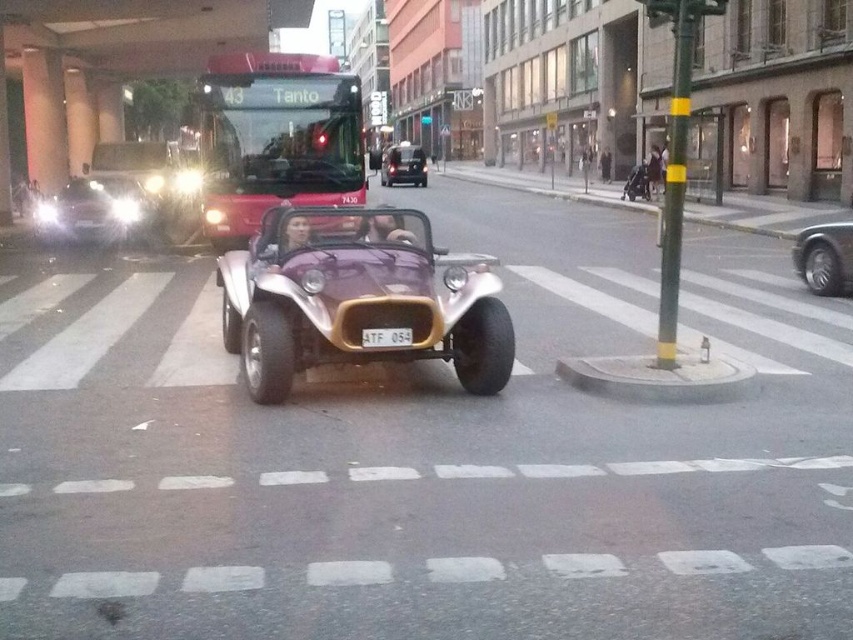
You are a delivery person needing to park your 2.5 meter wide van. You see the metallic red bus at center and the shiny black car at center. Which vehicle has a width that allows your van to park next to it without overlapping?

The metallic red bus at center has a larger width than the shiny black car at center. Since your van is 2.5 meters wide, you can park next to the shiny black car at center as it is narrower, allowing enough space for both vehicles.

You are a pedestrian standing on the sidewalk near the purple metallic car at center and the metallic purple car at center. Which car is closer to you?

Both cars are the same car, so they are equally close to you.

You are a pedestrian standing on the sidewalk. You see the metallic red bus at center and the metallic purple car at center. Which vehicle is taller?

The metallic purple car at center is taller than the metallic red bus at center.